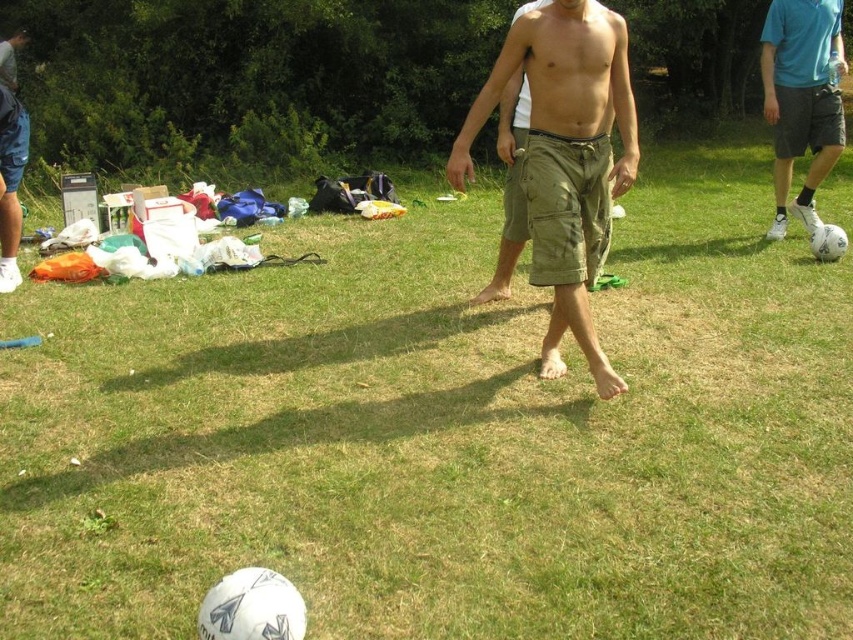
Question: Which point appears closest to the camera in this image?

Choices:
 (A) (9, 154)
 (B) (828, 109)

Answer: (A)

Question: Is khaki cotton shorts at center positioned at the back of white matte soccer ball at right?

Choices:
 (A) yes
 (B) no

Answer: (B)

Question: Which point is closer to the camera?

Choices:
 (A) white matte soccer ball at right
 (B) brushed metal water at bottle left
 (C) khaki cotton shorts at center

Answer: (C)

Question: Can you confirm if white matte soccer ball at right is wider than brushed metal water at bottle left?

Choices:
 (A) no
 (B) yes

Answer: (B)

Question: Which object appears farthest from the camera in this image?

Choices:
 (A) khaki cotton shorts at center
 (B) brushed metal water at bottle left
 (C) white matte soccer ball at right

Answer: (C)

Question: Can you confirm if khaki cotton shorts at center is thinner than brushed metal water at bottle left?

Choices:
 (A) no
 (B) yes

Answer: (A)